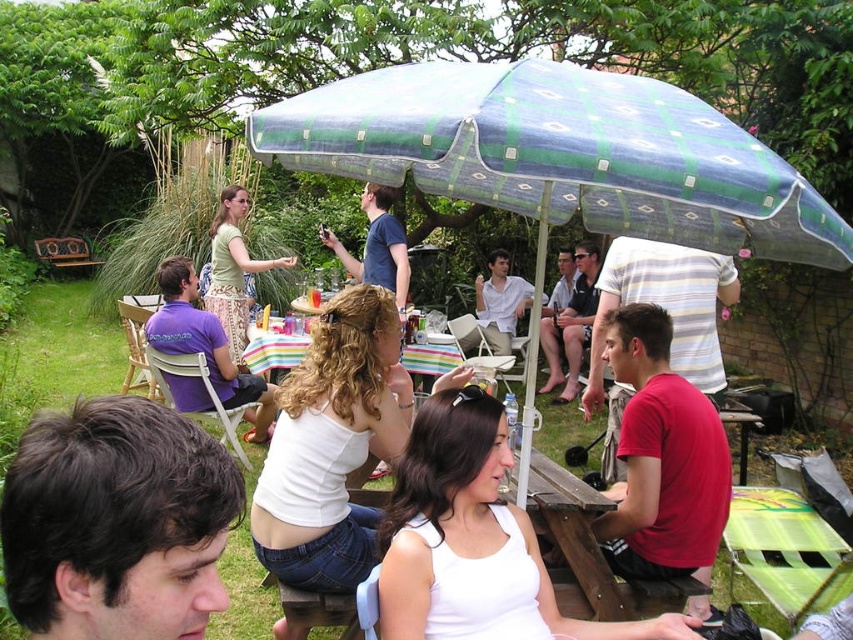
You are helping to organize a clothing donation drive and need to decide which shirts can fit into a narrow donation box. The box can only accommodate shirts that are thinner than 10 cm. You see the purple cotton shirt at left and the matte green shirt at center. Based on their thickness, which shirt is more likely to fit into the donation box?

The purple cotton shirt at left is thinner than the matte green shirt at center, so it is more likely to fit into the narrow donation box.

You are standing at the edge of the garden and want to greet the person with dark brown hair at center. Which direction should you walk to reach them?

The dark brown hair at center is located at point 0.817 on the x and 0.137 on the y coordinate. Since you are at the edge of the garden, you should walk towards the center to reach them.